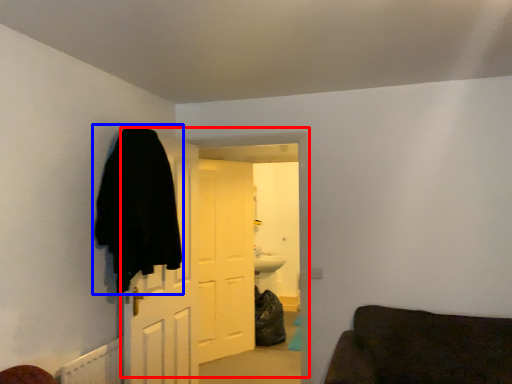
Question: Which of the following is the closest to the observer, door (highlighted by a red box) or cloak (highlighted by a blue box)?

Choices:
 (A) door
 (B) cloak

Answer: (B)